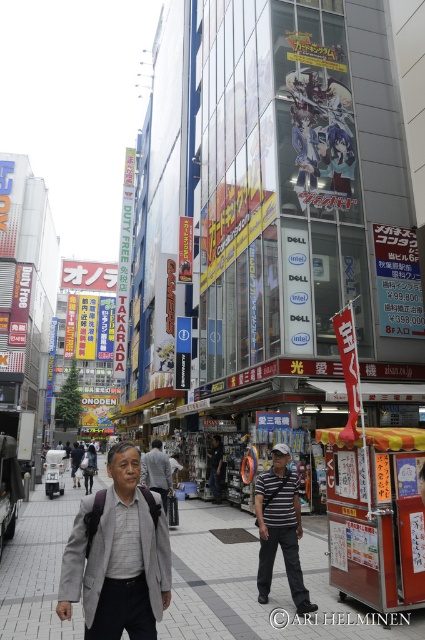
You are a delivery person in a gray fabric jacket at center, and you need to deliver a package to a customer standing at point 0.869, 0.278. Can you confirm your current position matches the delivery location?

Yes, the gray fabric jacket at center is located at point (118, 556), so you are at the correct delivery location.